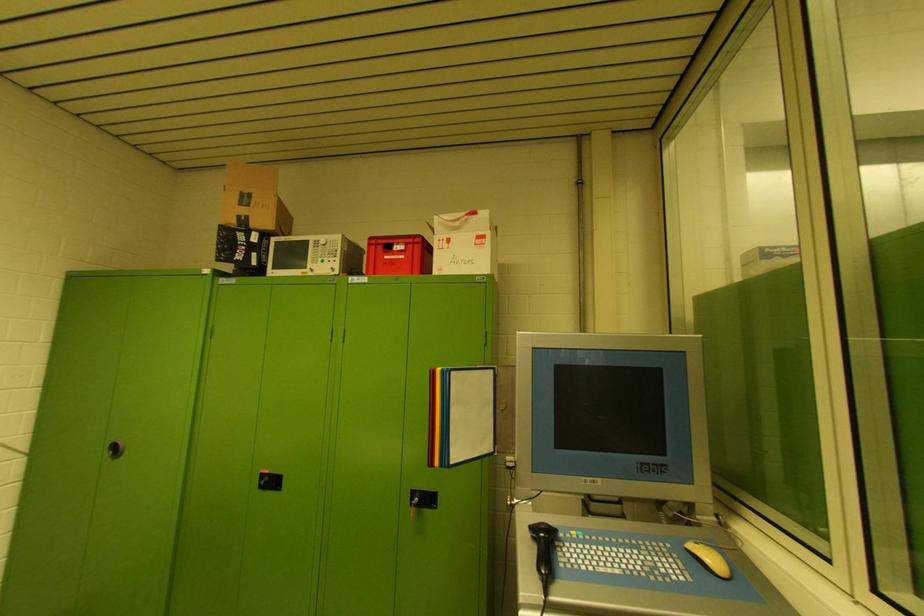
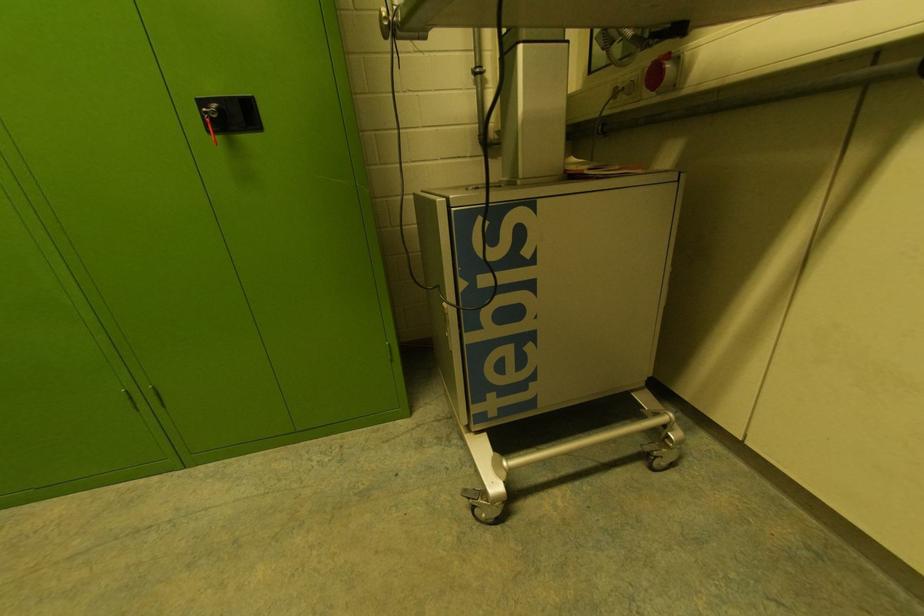
Based on the continuous images, in which direction is the camera rotating?

The camera rotated toward right-down.